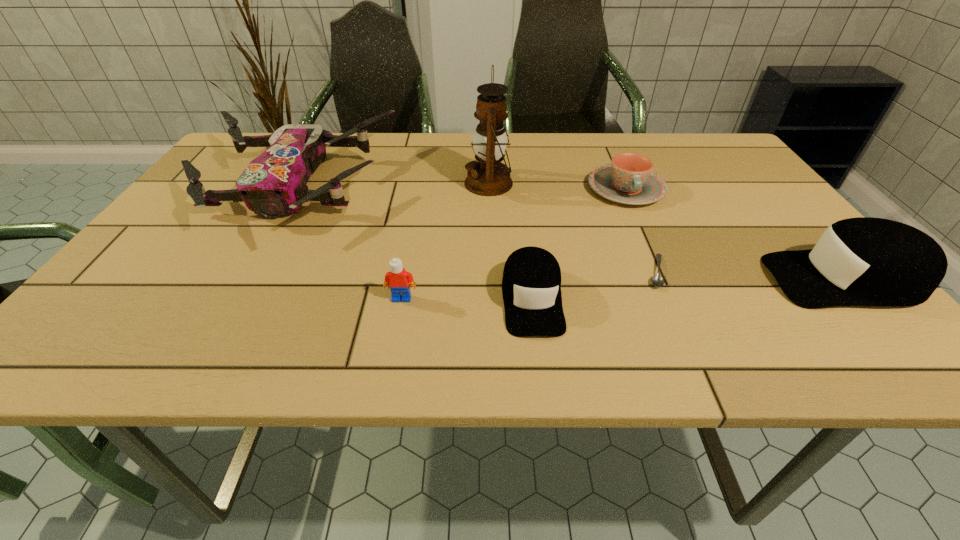
You are a GUI agent. You are given a task and a screenshot of the screen. Output one action in this format:
    pyautogui.click(x=<x>, y=<y>)
    Task: Click on the soupspoon that is at the near edge
    The image size is (960, 540).
    Given the screenshot: What is the action you would take?
    pyautogui.click(x=657, y=280)

Where is `Lego that is positioned at the near edge`? The width and height of the screenshot is (960, 540). Lego that is positioned at the near edge is located at coordinates (398, 279).

Identify the location of object that is at the left edge. (274, 184).

Where is `object positioned at the right edge`? object positioned at the right edge is located at coordinates (864, 261).

Where is `object that is at the far left corner`? The height and width of the screenshot is (540, 960). object that is at the far left corner is located at coordinates (274, 184).

In order to click on object located in the near right corner section of the desktop in this screenshot , I will do `click(864, 261)`.

In the image, there is a desktop. Identify the location of free space at the far edge. (549, 171).

Where is `vacant space at the near edge of the desktop`? Image resolution: width=960 pixels, height=540 pixels. vacant space at the near edge of the desktop is located at coordinates (437, 287).

I want to click on vacant position at the left edge of the desktop, so click(x=233, y=227).

Where is `free space at the right edge`? free space at the right edge is located at coordinates (757, 199).